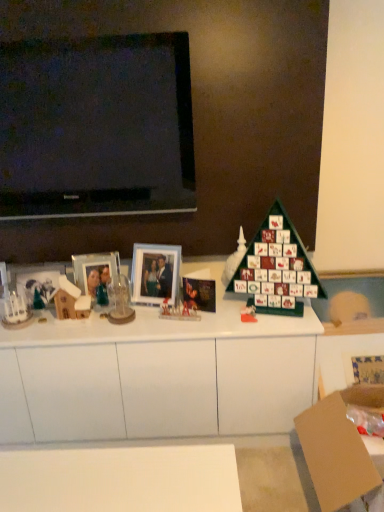
Question: Considering the relative sizes of green matte advent calendar at center, marked as the fourth toy in a left-to-right arrangement, and glossy paper christmas card at center in the image provided, is green matte advent calendar at center, marked as the fourth toy in a left-to-right arrangement, wider than glossy paper christmas card at center?

Choices:
 (A) no
 (B) yes

Answer: (A)

Question: Does green matte advent calendar at center, marked as the fourth toy in a left-to-right arrangement, have a larger size compared to glossy paper christmas card at center?

Choices:
 (A) no
 (B) yes

Answer: (A)

Question: Is green matte advent calendar at center, marked as the fourth toy in a left-to-right arrangement, closer to camera compared to glossy paper christmas card at center?

Choices:
 (A) no
 (B) yes

Answer: (B)

Question: Are green matte advent calendar at center, which is the first toy from right to left, and glossy paper christmas card at center far apart?

Choices:
 (A) yes
 (B) no

Answer: (B)

Question: From the image's perspective, does green matte advent calendar at center, marked as the fourth toy in a left-to-right arrangement, appear lower than glossy paper christmas card at center?

Choices:
 (A) yes
 (B) no

Answer: (A)

Question: From the image's perspective, is matte plastic picture frame at center, the first picture frame positioned from the right, positioned above or below glossy paper christmas card at center?

Choices:
 (A) below
 (B) above

Answer: (B)

Question: Looking at their shapes, would you say matte plastic picture frame at center, the first picture frame positioned from the right, is wider or thinner than glossy paper christmas card at center?

Choices:
 (A) thin
 (B) wide

Answer: (A)

Question: From a real-world perspective, relative to glossy paper christmas card at center, is matte plastic picture frame at center, the second picture frame from the left, vertically above or below?

Choices:
 (A) above
 (B) below

Answer: (A)

Question: Would you say matte plastic picture frame at center, the first picture frame positioned from the right, is to the left or to the right of glossy paper christmas card at center in the picture?

Choices:
 (A) left
 (B) right

Answer: (A)

Question: From their relative heights in the image, would you say wooden house at left, which ranks as the fourth toy in right-to-left order, is taller or shorter than matte glass picture frame at left, the second picture frame in the right-to-left sequence?

Choices:
 (A) tall
 (B) short

Answer: (B)

Question: In the image, is wooden house at left, acting as the first toy starting from the left, positioned in front of or behind matte glass picture frame at left, the second picture frame in the right-to-left sequence?

Choices:
 (A) behind
 (B) front

Answer: (B)

Question: Based on their sizes in the image, would you say wooden house at left, which ranks as the fourth toy in right-to-left order, is bigger or smaller than matte glass picture frame at left, the second picture frame in the right-to-left sequence?

Choices:
 (A) small
 (B) big

Answer: (B)

Question: Is wooden house at left, which ranks as the fourth toy in right-to-left order, spatially inside matte glass picture frame at left, arranged as the first picture frame when viewed from the left, or outside of it?

Choices:
 (A) inside
 (B) outside

Answer: (B)

Question: Based on their positions, is green matte advent calendar at center, marked as the fourth toy in a left-to-right arrangement, located to the left or right of translucent glass figurine at center, which appears as the third toy when viewed from the right?

Choices:
 (A) right
 (B) left

Answer: (A)

Question: From the image's perspective, is green matte advent calendar at center, which is the first toy from right to left, positioned above or below translucent glass figurine at center, which appears as the third toy when viewed from the right?

Choices:
 (A) above
 (B) below

Answer: (B)